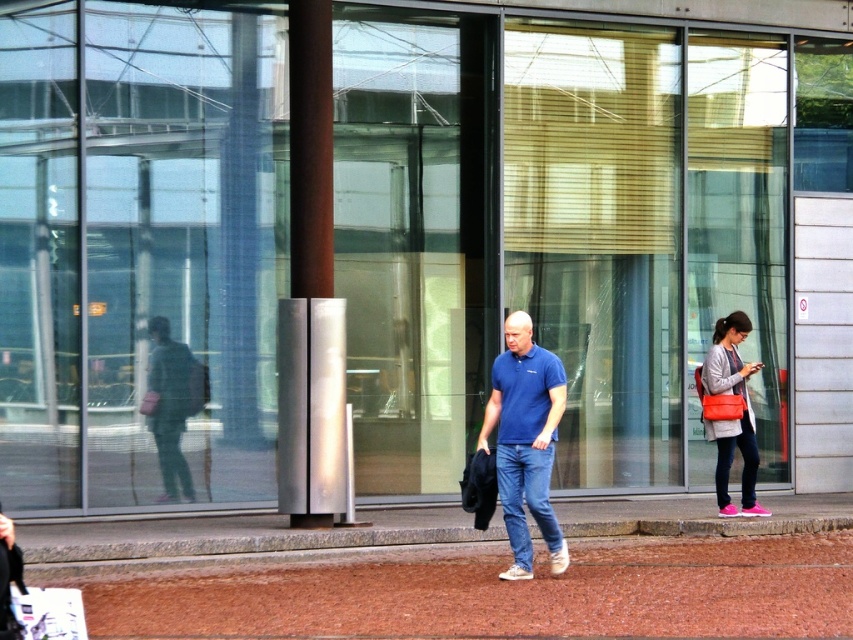
From the picture: You are standing on the pedestrian walkway and want to place a small potted plant between the brown gravel at center and the blue cotton polo shirt at center. Which object should the plant be closer to in order to be visible from the camera angle?

The plant should be closer to the blue cotton polo shirt at center because it is taller than the brown gravel at center, making it more likely to be visible from the camera angle.

You are standing at the point marked by the coordinates point (171,404) in the image. What color is the fabric of the jacket located to your immediate left?

The point (171,404) marks the green fabric jacket at left, so the jacket to your immediate left is green in color.

Based on the photo, you are standing at the point with coordinates point (170,472) and want to walk towards the point with coordinates point (720,435). Which direction should you face to walk directly towards it?

You should face towards the direction of point (720,435), which is behind point (170,472) since it is in front of it.